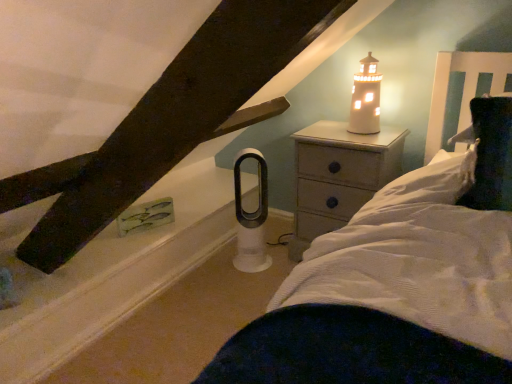
Identify the location of free space in front of white ceramic lighthouse at upper right. [366, 142].